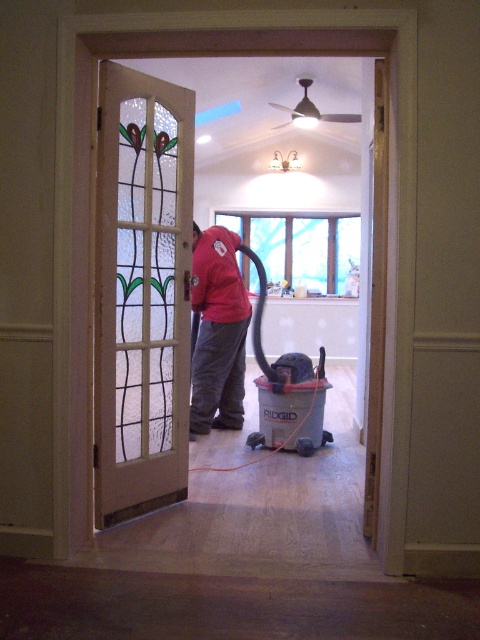
Question: Is stained glass door at left wider than red matte jacket at center?

Choices:
 (A) yes
 (B) no

Answer: (B)

Question: Does stained glass door at left appear over red matte jacket at center?

Choices:
 (A) yes
 (B) no

Answer: (A)

Question: Which object is farther from the camera taking this photo?

Choices:
 (A) red matte jacket at center
 (B) stained glass door at left

Answer: (A)

Question: Is stained glass door at left to the left of red matte jacket at center from the viewer's perspective?

Choices:
 (A) yes
 (B) no

Answer: (A)

Question: Which object is farther from the camera taking this photo?

Choices:
 (A) stained glass door at left
 (B) red matte jacket at center

Answer: (B)